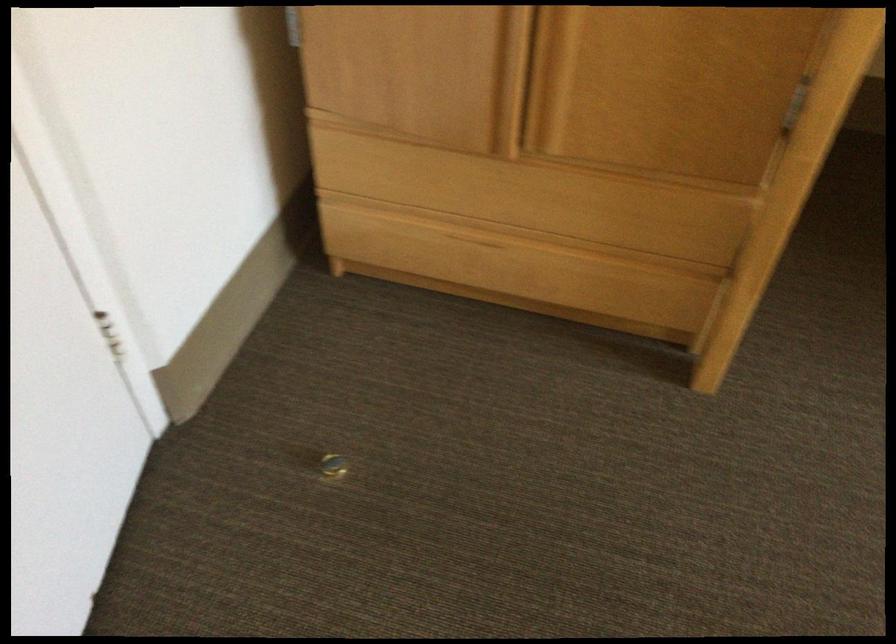
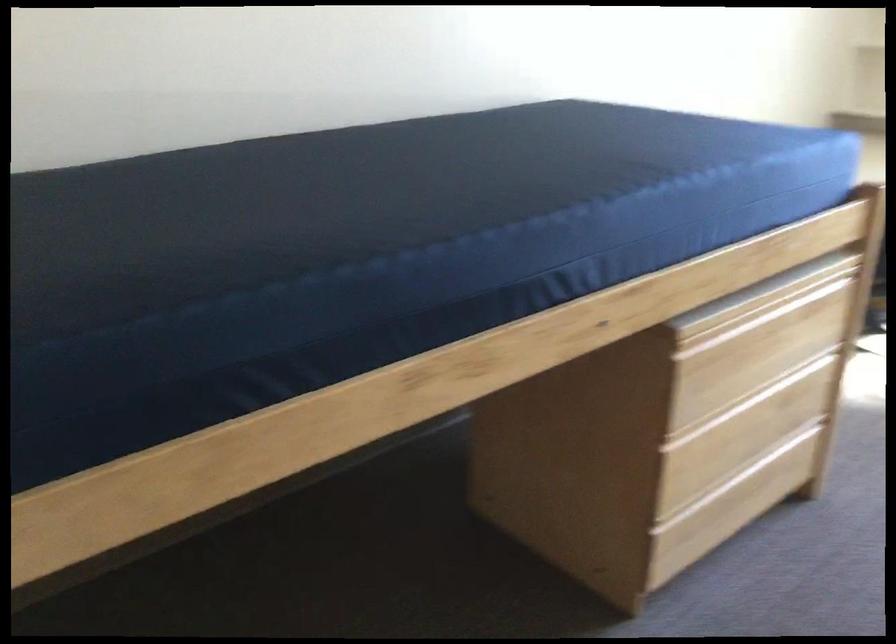
Question: The camera is either moving clockwise (left) or counter-clockwise (right) around the object. The first image is from the beginning of the video and the second image is from the end. Is the camera moving left or right when shooting the video?

Choices:
 (A) Left
 (B) Right

Answer: (A)